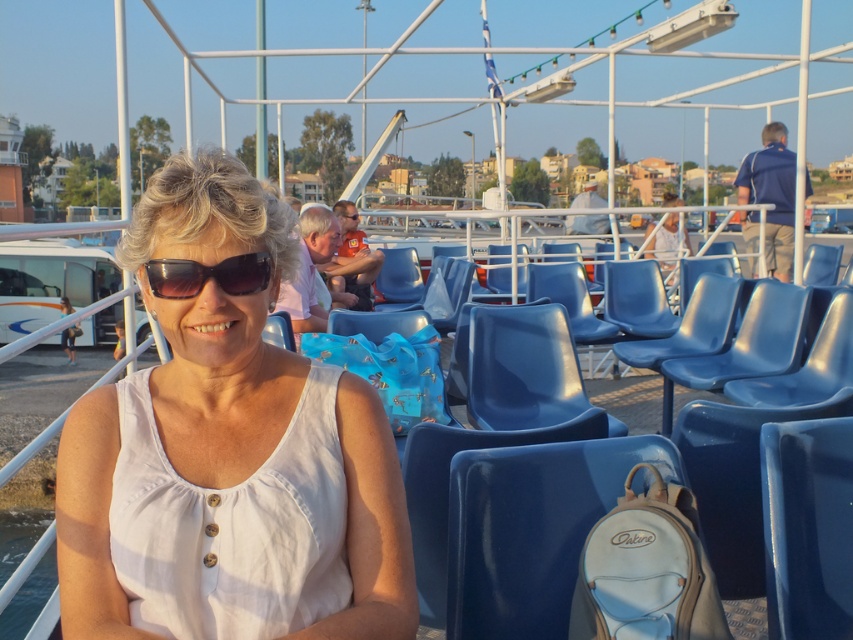
You are a photographer taking a picture of the woman in the scene. You notice the white cotton tank top at center and the black plastic goggles at center. Which item is closer to the camera?

The white cotton tank top at center is positioned under the black plastic goggles at center, so the goggles are closer to the camera.

You are standing on the ferry and want to move from the point at coordinates point (131, 531) to the point at coordinates point (357, 212). Which direction should you move to get closer to your destination?

To move from point (131, 531) to point (357, 212), you should move backward since point (131, 531) is in front of point (357, 212).

Looking at this image, you are a passenger on the ferry and want to place your belongings in a secure location. The white leather backpack at lower center is currently occupying a spot. Can you determine if this spot is near the edge of the ferry where it might be unsafe?

The position of white leather backpack at lower center is at point (532, 529), which is near the edge of the ferry. Therefore, placing belongings there might be unsafe due to proximity to the edge.